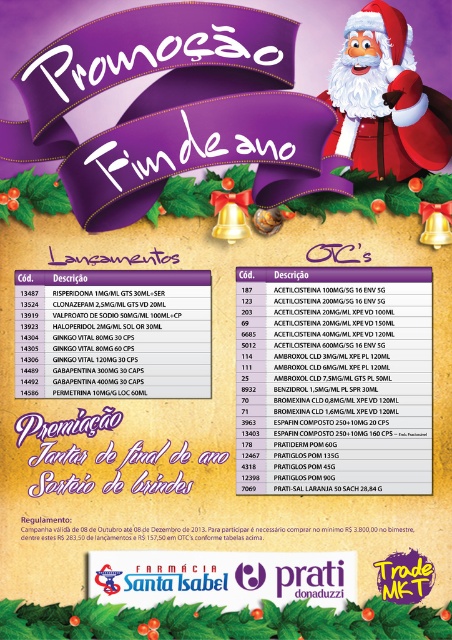
Question: Can you confirm if matte black text at center is positioned above white plush santa at upper right?

Choices:
 (A) no
 (B) yes

Answer: (A)

Question: Is white paper at center closer to the viewer compared to white plush santa at upper right?

Choices:
 (A) no
 (B) yes

Answer: (A)

Question: Which object is farther from the camera taking this photo?

Choices:
 (A) white paper text at center
 (B) matte black text at center
 (C) white paper at center

Answer: (C)

Question: Which of the following is the farthest from the observer?

Choices:
 (A) (168, 326)
 (B) (358, 138)

Answer: (B)

Question: Which object is positioned closest to the white paper text at center?

Choices:
 (A) white plush santa at upper right
 (B) white paper at center
 (C) matte black text at center

Answer: (C)

Question: Can you confirm if matte black text at center is positioned to the left of white paper at center?

Choices:
 (A) no
 (B) yes

Answer: (A)